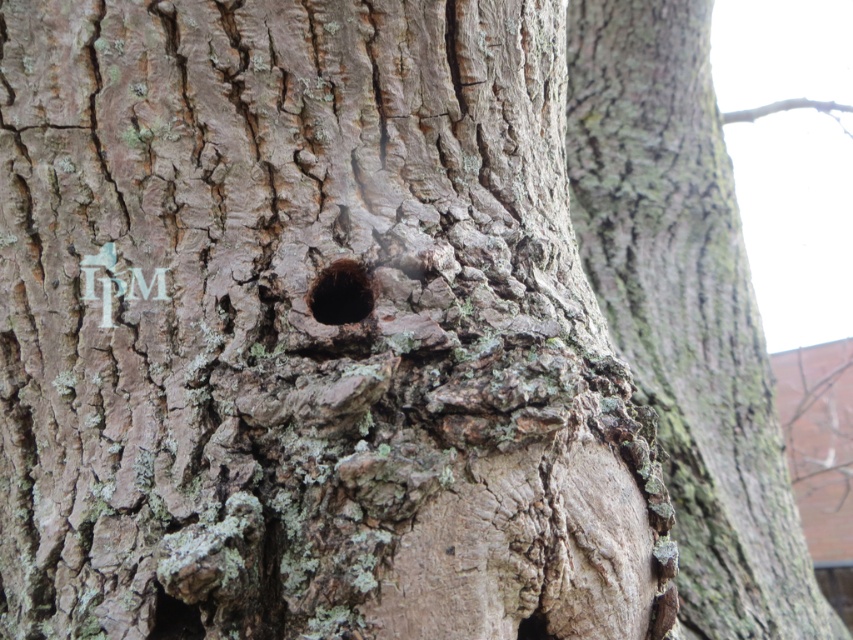
You are an arborist inspecting a tree trunk. You observe the black rough hole at center and the dark brown rough bark hole at lower left. Which hole has a greater height?

The black rough hole at center is taller than the dark brown rough bark hole at lower left.

You are a squirrel trying to find a safe spot to hide your acorn. You see two holes in the tree trunk. Which hole is closer to you so you can easily access it? The black rough hole at center and the dark brown rough bark hole at lower left.

The dark brown rough bark hole at lower left is closer to you because the black rough hole at center is further away, so you can easily access the dark brown rough bark hole at lower left.

You are a photographer holding a camera 1 meter tall. You want to take a closeup of the black rough hole at center. Can you focus on the hole without moving the camera?

The black rough hole at center and camera are 1.01 meters apart, so the distance is slightly more than the camera height. Since the camera can focus at that distance, you can focus on the black rough hole at center without moving the camera.